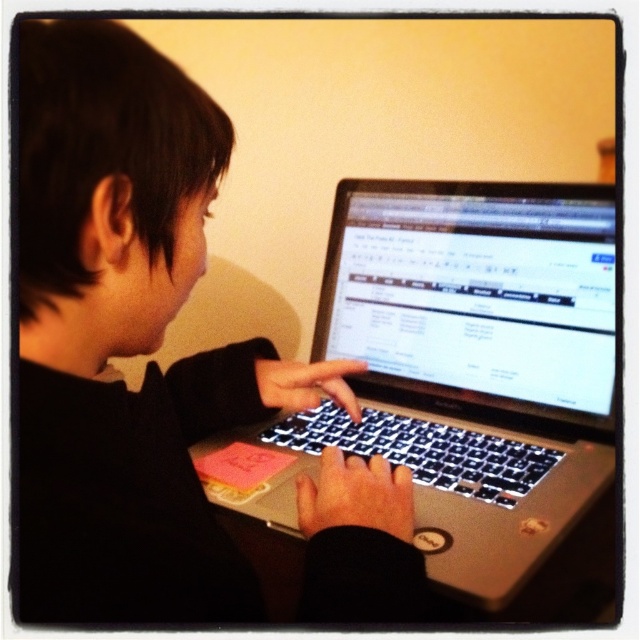
Is matte black laptop at center to the right of silver metallic laptop at center from the viewer's perspective?

Incorrect, matte black laptop at center is not on the right side of silver metallic laptop at center.

Identify the location of matte black laptop at center. This screenshot has height=640, width=640. (125, 336).